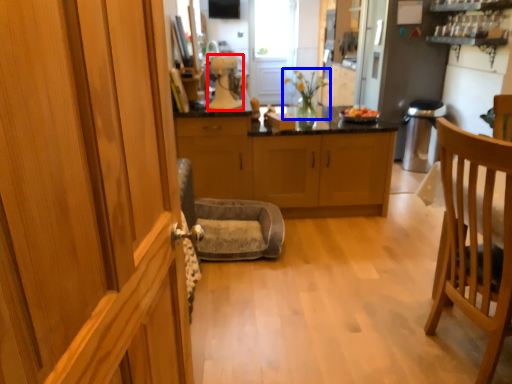
Question: Which object appears farthest to the camera in this image, kitchen appliance (highlighted by a red box) or houseplant (highlighted by a blue box)?

Choices:
 (A) kitchen appliance
 (B) houseplant

Answer: (B)